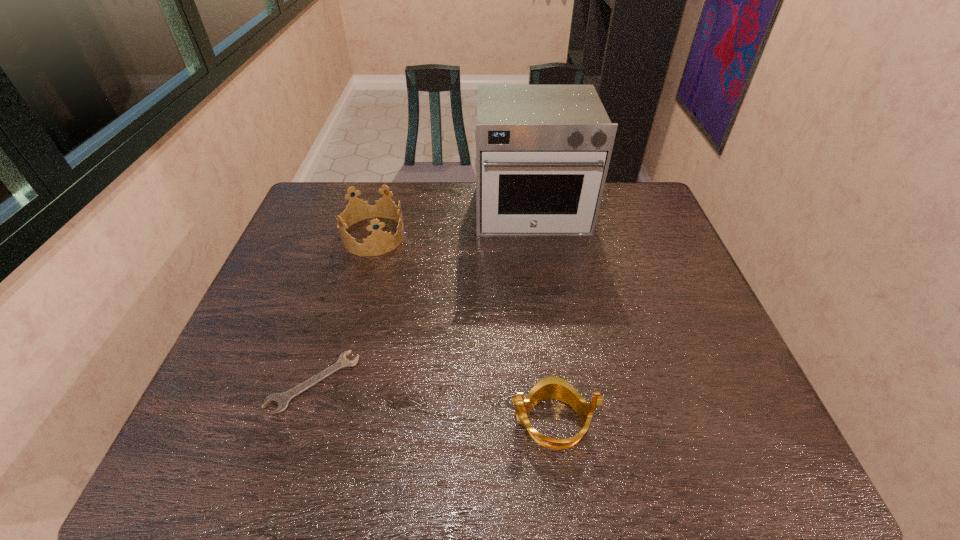
Find the location of a particular element. vacant space located at the front emblem of the nearer tiara is located at coordinates (403, 422).

Identify the location of free space located on the back of the wrench. The height and width of the screenshot is (540, 960). (350, 264).

Where is `toaster oven at the far edge`? The width and height of the screenshot is (960, 540). toaster oven at the far edge is located at coordinates (542, 151).

Locate an element on the screen. This screenshot has height=540, width=960. tiara situated at the far edge is located at coordinates (379, 242).

I want to click on object positioned at the near edge, so (x=556, y=388).

In order to click on tiara located at the left edge in this screenshot , I will do `click(379, 242)`.

Where is `wrench that is at the left edge`? The image size is (960, 540). wrench that is at the left edge is located at coordinates (282, 399).

Find the location of `object present at the far left corner`. object present at the far left corner is located at coordinates (379, 242).

You are a GUI agent. You are given a task and a screenshot of the screen. Output one action in this format:
    pyautogui.click(x=<x>, y=<y>)
    Task: Click on the vacant space at the far edge of the desktop
    The image size is (960, 540).
    Given the screenshot: What is the action you would take?
    pos(370,222)

In the image, there is a desktop. Where is `free space at the near edge`? free space at the near edge is located at coordinates (404, 434).